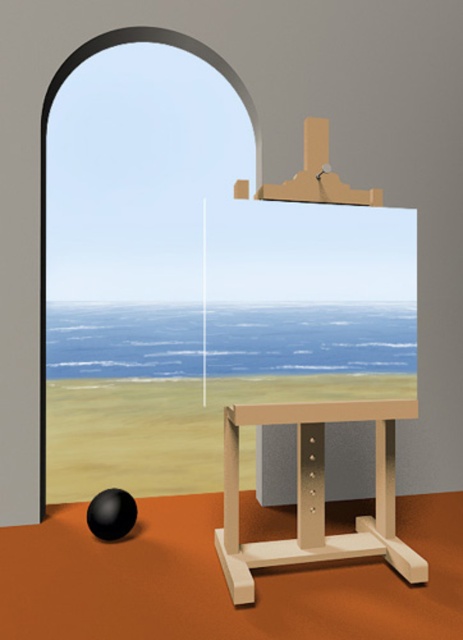
Does smooth glass arch at upper left have a smaller size compared to black rubber ball at lower left?

Incorrect, smooth glass arch at upper left is not smaller in size than black rubber ball at lower left.

Can you confirm if smooth glass arch at upper left is wider than black rubber ball at lower left?

Yes.

Describe the element at coordinates (45, 163) in the screenshot. I see `smooth glass arch at upper left` at that location.

In order to click on smooth glass arch at upper left in this screenshot , I will do `click(45, 163)`.

Does point (285, 561) come in front of point (114, 493)?

That is True.

Which is in front, point (277, 557) or point (88, 512)?

Positioned in front is point (277, 557).

Who is more forward, [388,522] or [102,531]?

Point [388,522] is in front.

At what (x,y) coordinates should I click in order to perform the action: click on wooden easel at center. Please return your answer as a coordinate pair (x, y). This screenshot has width=463, height=640. Looking at the image, I should click on (314, 493).

Is point (374, 538) less distant than point (111, 35)?

Yes.

The width and height of the screenshot is (463, 640). Describe the element at coordinates (314, 493) in the screenshot. I see `wooden easel at center` at that location.

Describe the element at coordinates (314, 493) in the screenshot. I see `wooden easel at center` at that location.

The width and height of the screenshot is (463, 640). Identify the location of wooden easel at center. (314, 493).